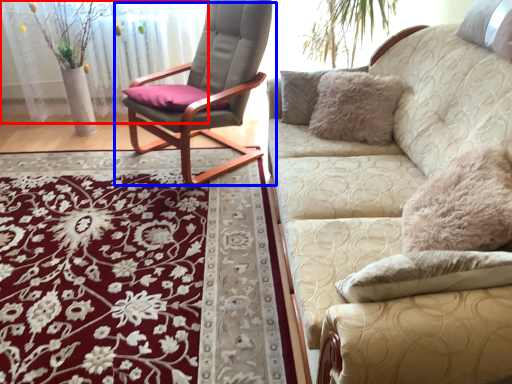
Question: Which object is further to the camera taking this photo, glass door (highlighted by a red box) or chair (highlighted by a blue box)?

Choices:
 (A) glass door
 (B) chair

Answer: (A)